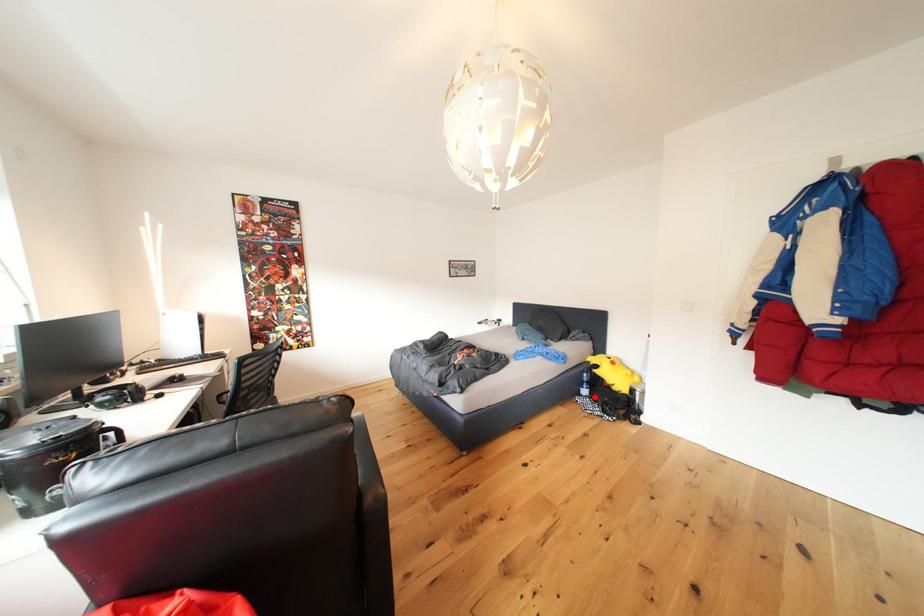
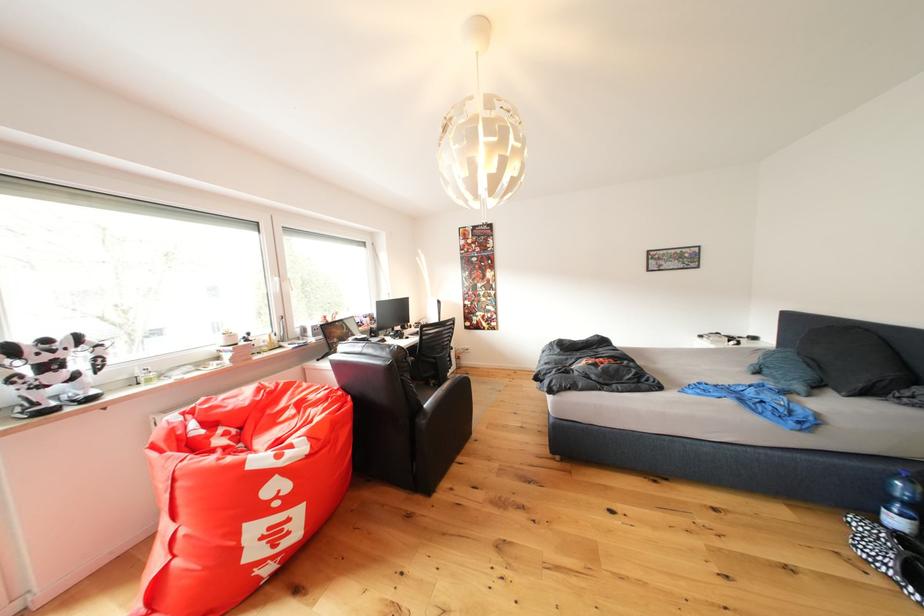
Question: I am providing you with two images of the same scene from different viewpoints. Given a red point in image1, look at the same physical point in image2. Is it:

Choices:
 (A) Closer to the viewpoint
 (B) Farther from the viewpoint

Answer: (A)